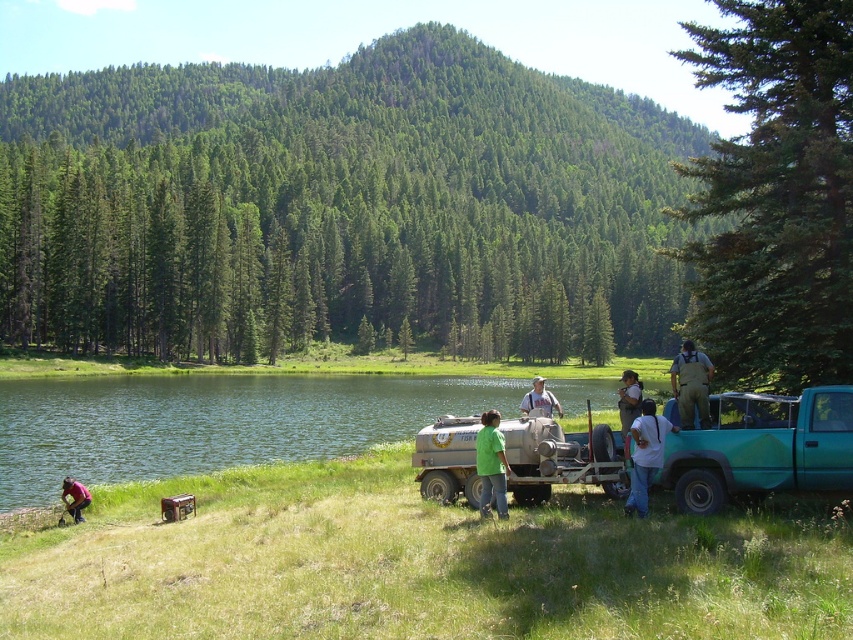
Is white cotton shirt at lower right below light blue shirt at center?

No, white cotton shirt at lower right is not below light blue shirt at center.

Is point (627, 504) positioned in front of point (622, 376)?

Yes, point (627, 504) is in front of point (622, 376).

Locate an element on the screen. The width and height of the screenshot is (853, 640). white cotton shirt at lower right is located at coordinates (645, 456).

Is camouflage fabric person at center right above green fabric shirt at lower left?

Indeed, camouflage fabric person at center right is positioned over green fabric shirt at lower left.

Identify the location of camouflage fabric person at center right. The height and width of the screenshot is (640, 853). (691, 385).

Between point (708, 378) and point (82, 490), which one is positioned in front?

Point (708, 378)

You are a GUI agent. You are given a task and a screenshot of the screen. Output one action in this format:
    pyautogui.click(x=<x>, y=<y>)
    Task: Click on the camouflage fabric person at center right
    
    Given the screenshot: What is the action you would take?
    pyautogui.click(x=691, y=385)

Identify the location of green matte shirt at center. (491, 464).

The image size is (853, 640). In order to click on green matte shirt at center in this screenshot , I will do `click(491, 464)`.